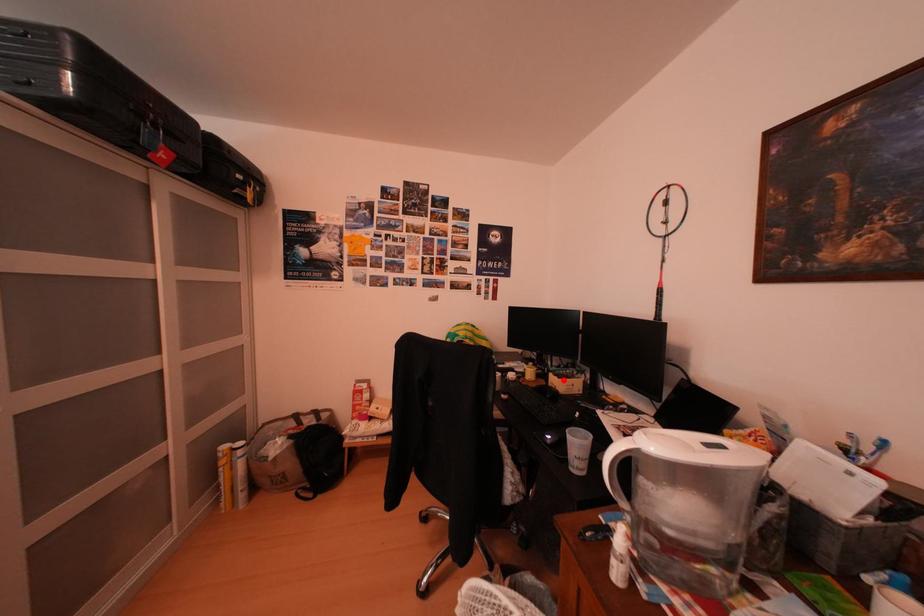
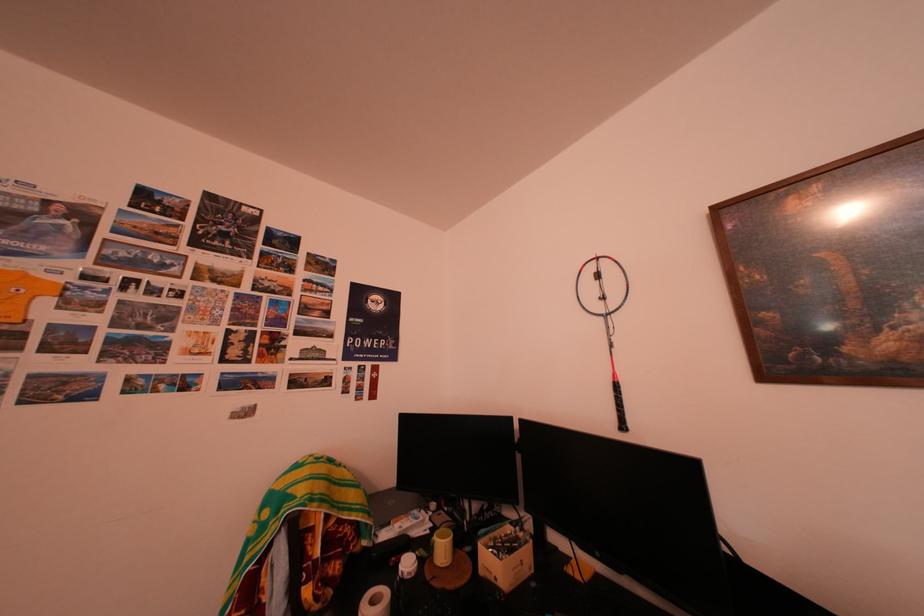
Locate, in the second image, the point that corresponds to the highlighted location in the first image.

(493, 552)